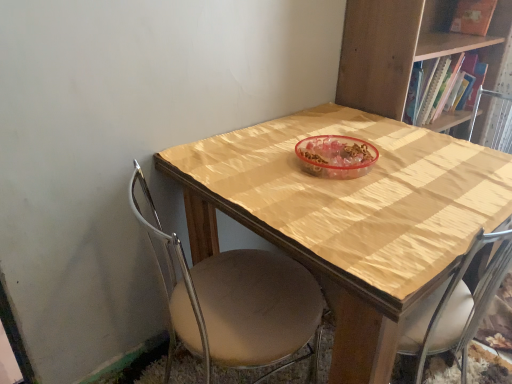
The image size is (512, 384). What do you see at coordinates (350, 216) in the screenshot? I see `wooden table at center` at bounding box center [350, 216].

The image size is (512, 384). Identify the location of wooden bookcase at upper right. (390, 49).

What is the approximate height of matte orange book at upper right?

matte orange book at upper right is 17.67 centimeters tall.

Identify the location of wooden table at center. (350, 216).

Measure the distance from matte orange book at upper right to wooden bookcase at upper right.

They are 19.88 inches apart.

Would you say matte orange book at upper right is outside wooden bookcase at upper right?

Actually, matte orange book at upper right is within wooden bookcase at upper right.

From a real-world perspective, is matte orange book at upper right located higher than wooden bookcase at upper right?

Correct, in the physical world, matte orange book at upper right is higher than wooden bookcase at upper right.

Is matte orange book at upper right to the left of wooden bookcase at upper right from the viewer's perspective?

No.

Where is `chair on the left of wooden bookcase at upper right`? The width and height of the screenshot is (512, 384). chair on the left of wooden bookcase at upper right is located at coordinates (236, 303).

Is wooden bookcase at upper right facing towards beige fabric chair at center?

No, wooden bookcase at upper right is not facing towards beige fabric chair at center.

From a real-world perspective, is wooden bookcase at upper right physically below beige fabric chair at center?

Actually, wooden bookcase at upper right is physically above beige fabric chair at center in the real world.

Is wooden bookcase at upper right in front of or behind beige fabric chair at center in the image?

Visually, wooden bookcase at upper right is located behind beige fabric chair at center.

Is wooden bookcase at upper right inside or outside of matte orange book at upper right?

wooden bookcase at upper right cannot be found inside matte orange book at upper right.

Is wooden bookcase at upper right oriented towards matte orange book at upper right?

No, wooden bookcase at upper right is not facing towards matte orange book at upper right.

Is the position of wooden bookcase at upper right less distant than that of matte orange book at upper right?

Yes, wooden bookcase at upper right is closer to the camera.

From the picture: Is wooden bookcase at upper right far from matte orange book at upper right?

No, wooden bookcase at upper right is not far from matte orange book at upper right.

Does matte orange book at upper right have a greater height compared to beige fabric chair at center?

Incorrect, the height of matte orange book at upper right is not larger of that of beige fabric chair at center.

Is matte orange book at upper right smaller than beige fabric chair at center?

Indeed, matte orange book at upper right has a smaller size compared to beige fabric chair at center.

In the scene shown: From the image's perspective, is matte orange book at upper right below beige fabric chair at center?

Actually, matte orange book at upper right appears above beige fabric chair at center in the image.

Considering the positions of point (455, 13) and point (248, 287), is point (455, 13) closer or farther from the camera than point (248, 287)?

Point (455, 13) appears to be farther away from the viewer than point (248, 287).

From the image's perspective, which object appears higher, matte orange book at upper right or wooden table at center?

From the image's view, matte orange book at upper right is above.

Is matte orange book at upper right not inside wooden table at center?

Yes.

Would you say matte orange book at upper right is a long distance from wooden table at center?

That's right, there is a large distance between matte orange book at upper right and wooden table at center.

There is a wooden table at center. At what (x,y) coordinates should I click in order to perform the action: click on book above it (from a real-world perspective). Please return your answer as a coordinate pair (x, y). The width and height of the screenshot is (512, 384). Looking at the image, I should click on (473, 17).

Could you tell me if beige fabric chair at center is turned towards matte orange book at upper right?

Yes, beige fabric chair at center is turned towards matte orange book at upper right.

Which is behind, beige fabric chair at center or matte orange book at upper right?

matte orange book at upper right is behind.

From a real-world perspective, is beige fabric chair at center on matte orange book at upper right?

No, from a real-world perspective, beige fabric chair at center is not on top of matte orange book at upper right.

In the scene shown: Can you tell me how much beige fabric chair at center and wooden table at center differ in facing direction?

beige fabric chair at center and wooden table at center are facing 89 degrees away from each other.

Who is taller, beige fabric chair at center or wooden table at center?

Standing taller between the two is beige fabric chair at center.

Between beige fabric chair at center and wooden table at center, which one is positioned in front?

beige fabric chair at center is more forward.

The image size is (512, 384). I want to click on bookcase below the matte orange book at upper right (from the image's perspective), so click(x=390, y=49).

Image resolution: width=512 pixels, height=384 pixels. In order to click on bookcase above the beige fabric chair at center (from the image's perspective) in this screenshot , I will do `click(390, 49)`.

When comparing their distances from wooden table at center, does matte orange book at upper right or wooden bookcase at upper right seem closer?

wooden bookcase at upper right.

When comparing their distances from beige fabric chair at center, does wooden table at center or wooden bookcase at upper right seem further?

wooden bookcase at upper right is positioned further to the anchor beige fabric chair at center.

Estimate the real-world distances between objects in this image. Which object is closer to wooden bookcase at upper right, beige fabric chair at center or wooden table at center?

Among the two, wooden table at center is located nearer to wooden bookcase at upper right.

Based on their spatial positions, is wooden table at center or beige fabric chair at center further from matte orange book at upper right?

beige fabric chair at center is further to matte orange book at upper right.

Based on their spatial positions, is beige fabric chair at center or matte orange book at upper right closer to wooden table at center?

Based on the image, beige fabric chair at center appears to be nearer to wooden table at center.

From the image, which object appears to be nearer to wooden bookcase at upper right, matte orange book at upper right or wooden table at center?

Among the two, wooden table at center is located nearer to wooden bookcase at upper right.

Consider the image. Based on their spatial positions, is beige fabric chair at center or wooden bookcase at upper right further from matte orange book at upper right?

beige fabric chair at center.

Estimate the real-world distances between objects in this image. Which object is closer to matte orange book at upper right, wooden bookcase at upper right or wooden table at center?

The object closer to matte orange book at upper right is wooden bookcase at upper right.

The height and width of the screenshot is (384, 512). Find the location of `table between wooden bookcase at upper right and beige fabric chair at center from top to bottom`. table between wooden bookcase at upper right and beige fabric chair at center from top to bottom is located at coordinates coord(350,216).

Identify the location of table located between beige fabric chair at center and matte orange book at upper right in the depth direction. 350,216.

Where is `bookcase between matte orange book at upper right and beige fabric chair at center in the vertical direction`? The width and height of the screenshot is (512, 384). bookcase between matte orange book at upper right and beige fabric chair at center in the vertical direction is located at coordinates (390, 49).

The width and height of the screenshot is (512, 384). In order to click on bookcase between wooden table at center and matte orange book at upper right in the front-back direction in this screenshot , I will do `click(390, 49)`.